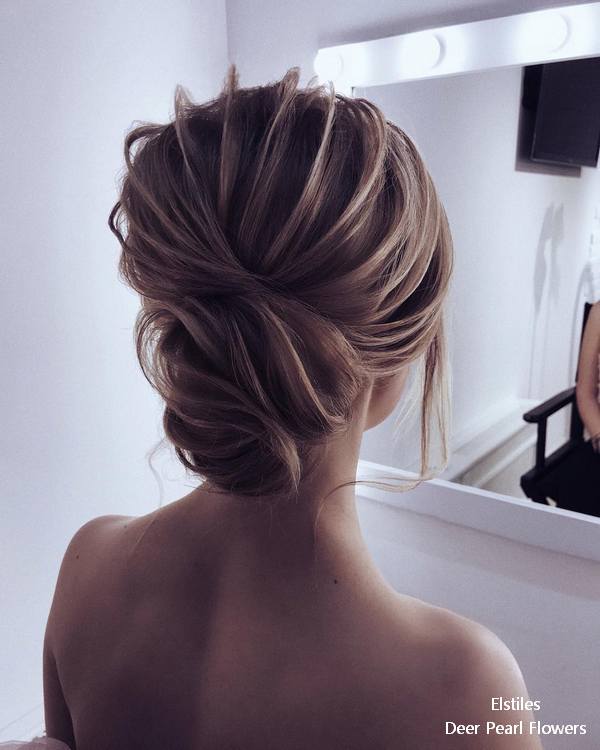
This screenshot has width=600, height=750. Identify the location of wall. (65, 453), (473, 573).